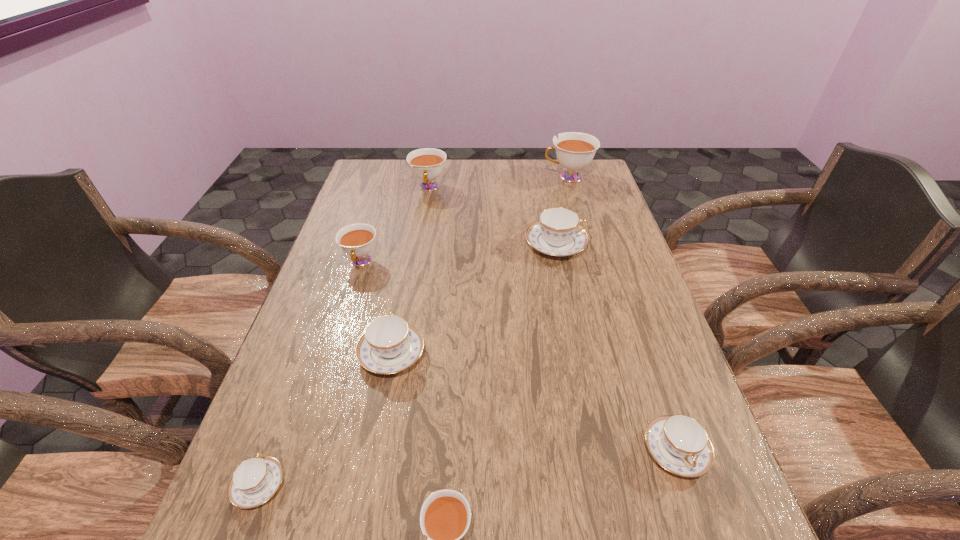
Identify the location of blue teacup that is the third closest to the biggest blue teacup. The height and width of the screenshot is (540, 960). (255, 480).

Identify the location of free point that satisfies the following two spatial constraints: 1. on the side of the tallest object with the handle; 2. on the side of the leftmost white teacup with the handle. This screenshot has width=960, height=540. (593, 262).

You are a GUI agent. You are given a task and a screenshot of the screen. Output one action in this format:
    pyautogui.click(x=<x>, y=<y>)
    Task: Click on the blank area in the image that satisfies the following two spatial constraints: 1. on the side of the tallest teacup with the handle; 2. on the side of the third biggest white teacup with the handle
    The image size is (960, 540).
    Given the screenshot: What is the action you would take?
    pyautogui.click(x=593, y=262)